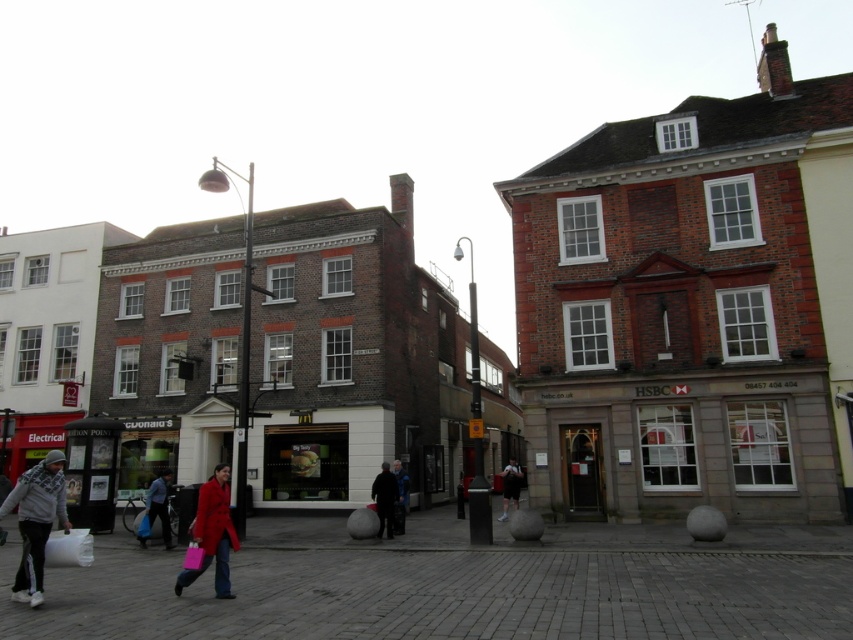
Question: Which object is the closest to the dark gray jacket at center?

Choices:
 (A) dark brown leather jacket at center
 (B) blue fabric coat at lower left

Answer: (B)

Question: Which object is farther from the camera taking this photo?

Choices:
 (A) dark gray cobblestone pavement at lower center
 (B) dark gray jacket at center

Answer: (B)

Question: Estimate the real-world distances between objects in this image. Which object is farther from the dark blue jeans at center?

Choices:
 (A) gray fleece jacket at lower left
 (B) matte red coat at lower left
 (C) dark gray cobblestone pavement at lower center

Answer: (A)

Question: Where is gray fleece jacket at lower left located in relation to blue denim jacket at center in the image?

Choices:
 (A) left
 (B) right

Answer: (A)

Question: Can you confirm if dark gray cobblestone pavement at lower center is positioned to the left of blue denim jacket at center?

Choices:
 (A) no
 (B) yes

Answer: (A)

Question: Does matte red coat at lower left appear under dark gray jacket at center?

Choices:
 (A) no
 (B) yes

Answer: (A)